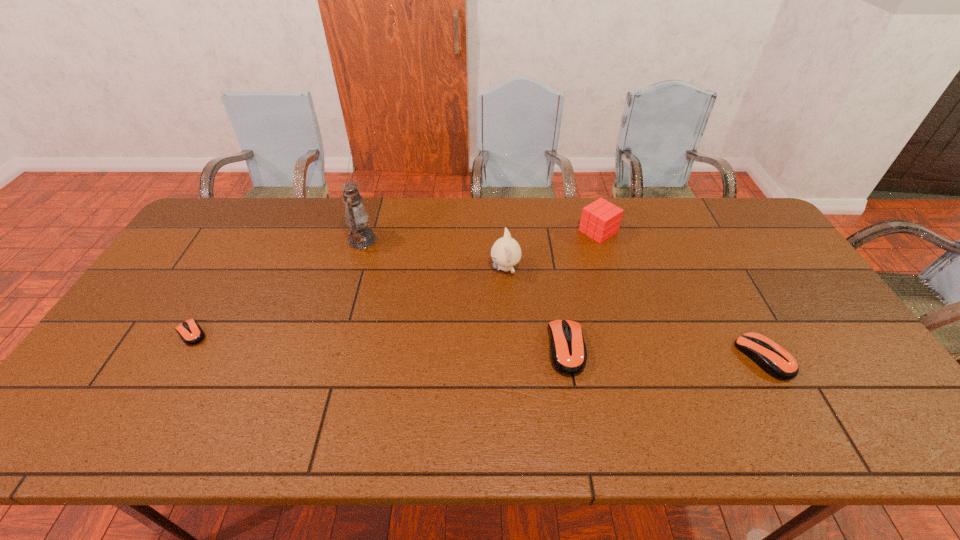
At what (x,y) coordinates should I click in order to perform the action: click on vacant area that lies between the second object from left to right and the cube. Please return your answer as a coordinate pair (x, y). Looking at the image, I should click on (480, 236).

You are a GUI agent. You are given a task and a screenshot of the screen. Output one action in this format:
    pyautogui.click(x=<x>, y=<y>)
    Task: Click on the free space between the kitten and the tallest object
    The width and height of the screenshot is (960, 540).
    Given the screenshot: What is the action you would take?
    pyautogui.click(x=434, y=254)

At what (x,y) coordinates should I click in order to perform the action: click on vacant space that is in between the rightmost computer mouse and the fifth object from left to right. Please return your answer as a coordinate pair (x, y). Image resolution: width=960 pixels, height=540 pixels. Looking at the image, I should click on (681, 294).

At what (x,y) coordinates should I click in order to perform the action: click on unoccupied position between the cube and the shortest computer mouse. Please return your answer as a coordinate pair (x, y). Image resolution: width=960 pixels, height=540 pixels. Looking at the image, I should click on (395, 282).

The width and height of the screenshot is (960, 540). What are the coordinates of `vacant area that lies between the second computer mouse from right to left and the third object from left to right` in the screenshot? It's located at (536, 308).

Find the location of a particular element. The height and width of the screenshot is (540, 960). vacant space that's between the leftmost object and the rightmost object is located at coordinates (477, 345).

This screenshot has height=540, width=960. I want to click on free spot between the leftmost object and the second computer mouse from left to right, so click(379, 341).

The image size is (960, 540). In order to click on vacant region between the second shortest computer mouse and the fourth nearest object in this screenshot , I will do `click(635, 313)`.

Locate an element on the screen. object that is the fifth closest to the leftmost object is located at coordinates (776, 361).

Identify which object is located as the fourth nearest to the oil lamp. Please provide its 2D coordinates. Your answer should be formatted as a tuple, i.e. [(x, y)], where the tuple contains the x and y coordinates of a point satisfying the conditions above.

[(600, 220)]